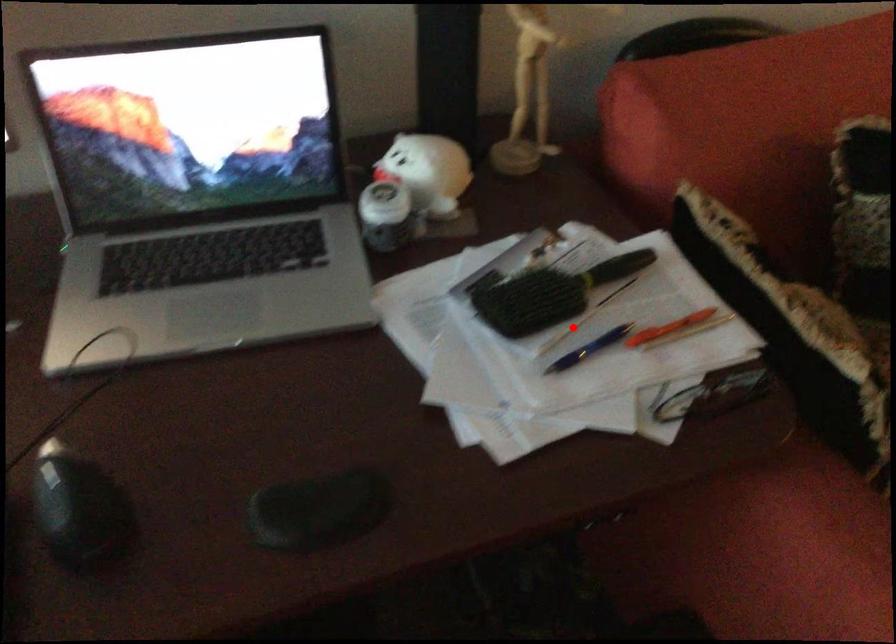
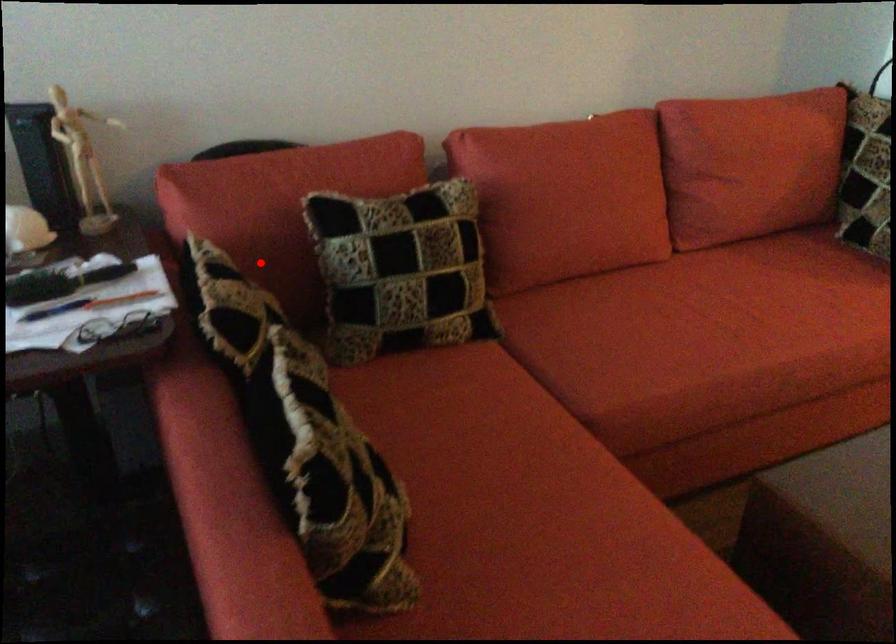
I am providing you with two images of the same scene from different viewpoints. A red point is marked on the first image and another point is marked on the second image. Are the points marked in image1 and image2 representing the same 3D position?

No